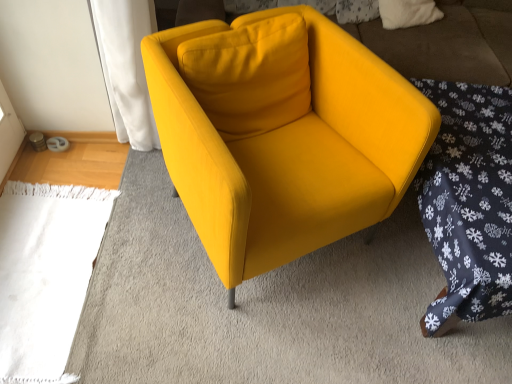
Question: From the image's perspective, is matte yellow armchair at center positioned above or below dark blue snowflake-patterned fabric at lower right?

Choices:
 (A) above
 (B) below

Answer: (A)

Question: Would you say matte yellow armchair at center is inside or outside dark blue snowflake-patterned fabric at lower right?

Choices:
 (A) outside
 (B) inside

Answer: (A)

Question: Based on their positions, is matte yellow armchair at center located to the left or right of dark blue snowflake-patterned fabric at lower right?

Choices:
 (A) right
 (B) left

Answer: (B)

Question: Considering the positions of dark blue snowflake-patterned fabric at lower right and matte yellow armchair at center in the image, is dark blue snowflake-patterned fabric at lower right bigger or smaller than matte yellow armchair at center?

Choices:
 (A) big
 (B) small

Answer: (B)

Question: In the image, is dark blue snowflake-patterned fabric at lower right on the left side or the right side of matte yellow armchair at center?

Choices:
 (A) right
 (B) left

Answer: (A)

Question: Is dark blue snowflake-patterned fabric at lower right inside or outside of matte yellow armchair at center?

Choices:
 (A) outside
 (B) inside

Answer: (A)

Question: From the image's perspective, is dark blue snowflake-patterned fabric at lower right positioned above or below matte yellow armchair at center?

Choices:
 (A) below
 (B) above

Answer: (A)